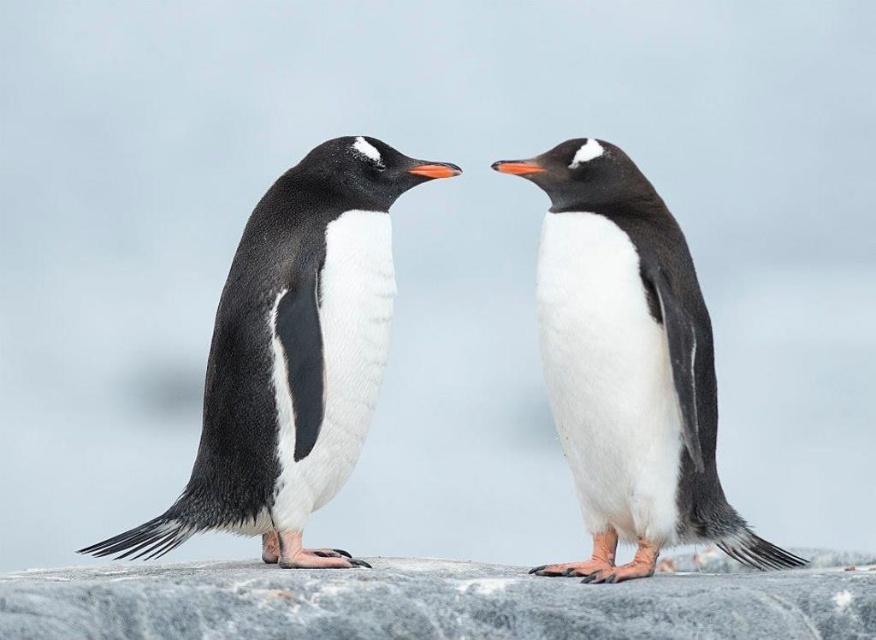
Does black glossy penguin at left appear on the right side of white matte penguin at center?

Incorrect, black glossy penguin at left is not on the right side of white matte penguin at center.

Is black glossy penguin at left below white matte penguin at center?

Actually, black glossy penguin at left is above white matte penguin at center.

The width and height of the screenshot is (876, 640). In order to click on black glossy penguin at left in this screenshot , I will do `click(293, 355)`.

Who is lower down, white matte penguin at center or gray granite rock at center?

gray granite rock at center is below.

Which is more to the right, white matte penguin at center or gray granite rock at center?

white matte penguin at center

Between point (595, 483) and point (793, 612), which one is positioned in front?

Point (793, 612) is in front.

The height and width of the screenshot is (640, 876). In order to click on white matte penguin at center in this screenshot , I will do `click(627, 365)`.

Can you confirm if black glossy penguin at left is positioned to the left of gray granite rock at center?

Correct, you'll find black glossy penguin at left to the left of gray granite rock at center.

Is black glossy penguin at left above gray granite rock at center?

Yes.

What do you see at coordinates (293, 355) in the screenshot?
I see `black glossy penguin at left` at bounding box center [293, 355].

At what (x,y) coordinates should I click in order to perform the action: click on black glossy penguin at left. Please return your answer as a coordinate pair (x, y). Looking at the image, I should click on (293, 355).